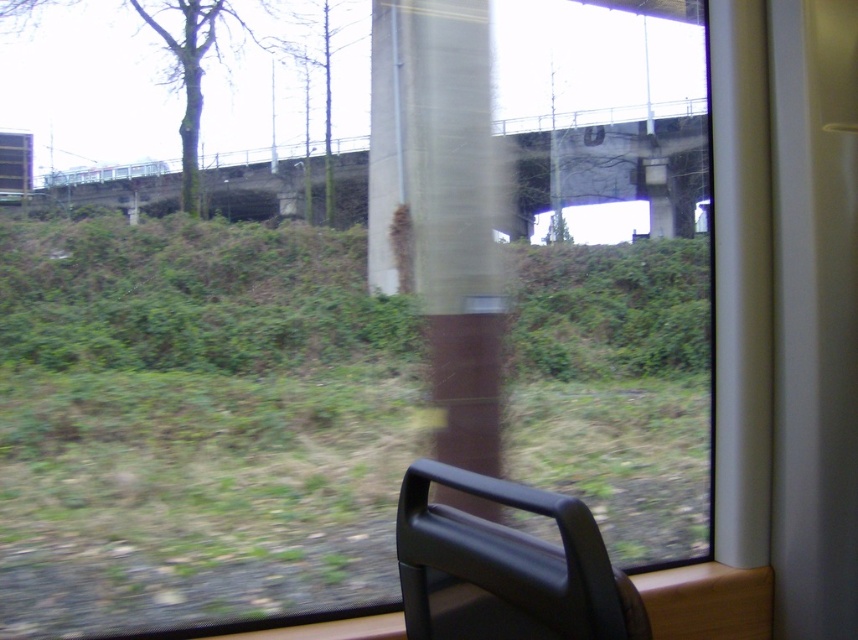
Locate an element on the screen. brown textured pillar at center is located at coordinates (456, 227).

Is brown textured pillar at center closer to camera compared to concrete bridge at center?

Yes, it is in front of concrete bridge at center.

Between point (460, 420) and point (663, 145), which one is positioned behind?

Point (663, 145)

Locate an element on the screen. brown textured pillar at center is located at coordinates (456, 227).

Who is positioned more to the right, brown textured pillar at center or black matte chair at lower right?

black matte chair at lower right

Find the location of a particular element. Image resolution: width=858 pixels, height=640 pixels. brown textured pillar at center is located at coordinates (456, 227).

Where is `brown textured pillar at center`? brown textured pillar at center is located at coordinates (456, 227).

Who is positioned more to the left, concrete bridge at center or black matte chair at lower right?

concrete bridge at center

Which is in front, point (529, 180) or point (488, 634)?

Point (488, 634)

Is point (369, 211) behind point (491, 620)?

Yes, point (369, 211) is behind point (491, 620).

Find the location of a particular element. The height and width of the screenshot is (640, 858). concrete bridge at center is located at coordinates (603, 164).